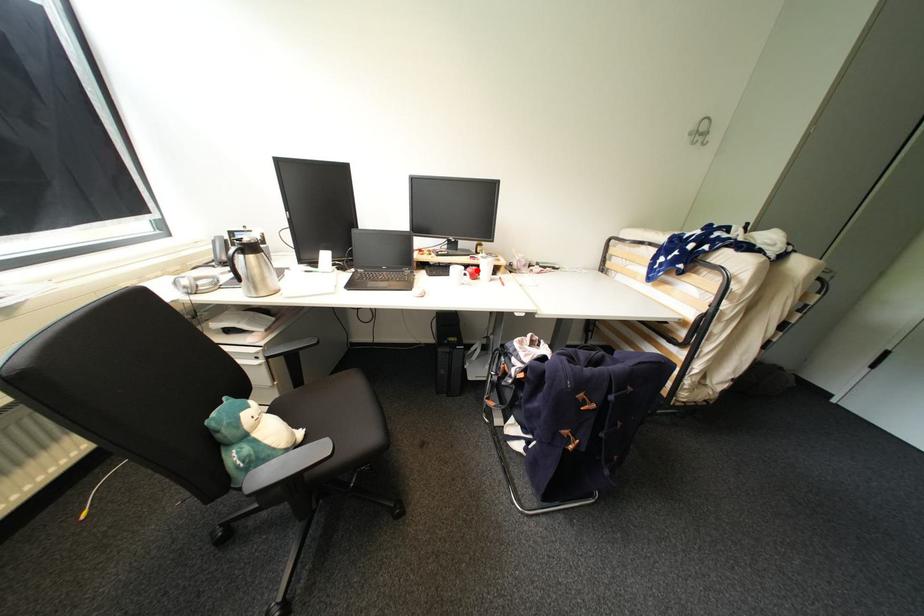
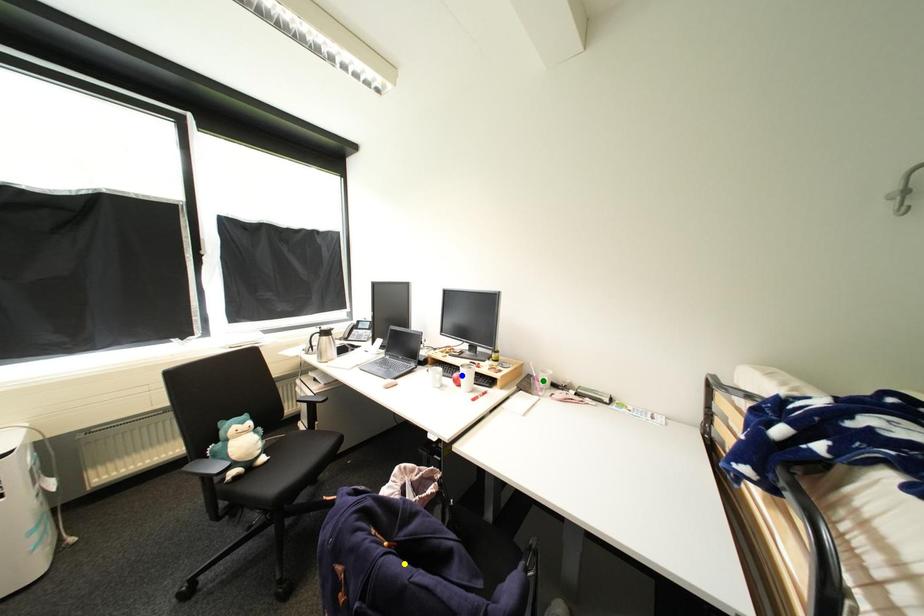
Question: I am providing you with two images of the same scene from different viewpoints. A red point is marked on the first image. You are given multiple points on the second image. Can you choose the point in image 2 that corresponds to the point in image 1?

Choices:
 (A) green point
 (B) yellow point
 (C) blue point

Answer: (C)